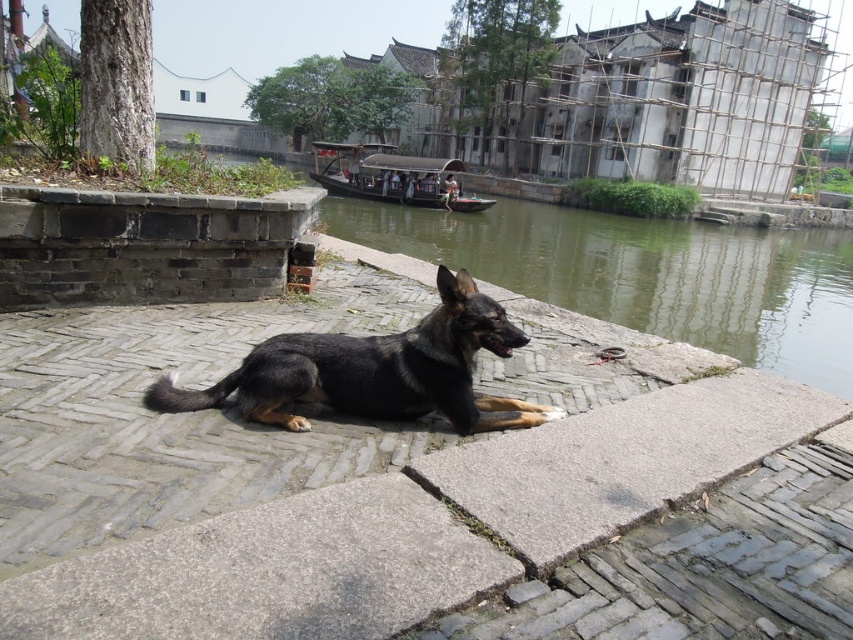
Question: In this image, where is greenish water at lower center located relative to shiny black fur at center?

Choices:
 (A) above
 (B) below

Answer: (A)

Question: Can you confirm if gray brick pavement at center is positioned below shiny black fur at center?

Choices:
 (A) yes
 (B) no

Answer: (A)

Question: From the image, what is the correct spatial relationship of greenish water at lower center in relation to shiny black fur at center?

Choices:
 (A) right
 (B) left

Answer: (A)

Question: Which of the following is the closest to the observer?

Choices:
 (A) wooden boat at center
 (B) shiny black fur at center
 (C) gray brick pavement at center

Answer: (C)

Question: Which of the following is the farthest from the observer?

Choices:
 (A) greenish water at lower center
 (B) shiny black fur at center
 (C) wooden boat at center
 (D) gray brick pavement at center

Answer: (C)

Question: Which point is farther from the camera taking this photo?

Choices:
 (A) (457, 168)
 (B) (387, 513)
 (C) (758, 234)

Answer: (C)